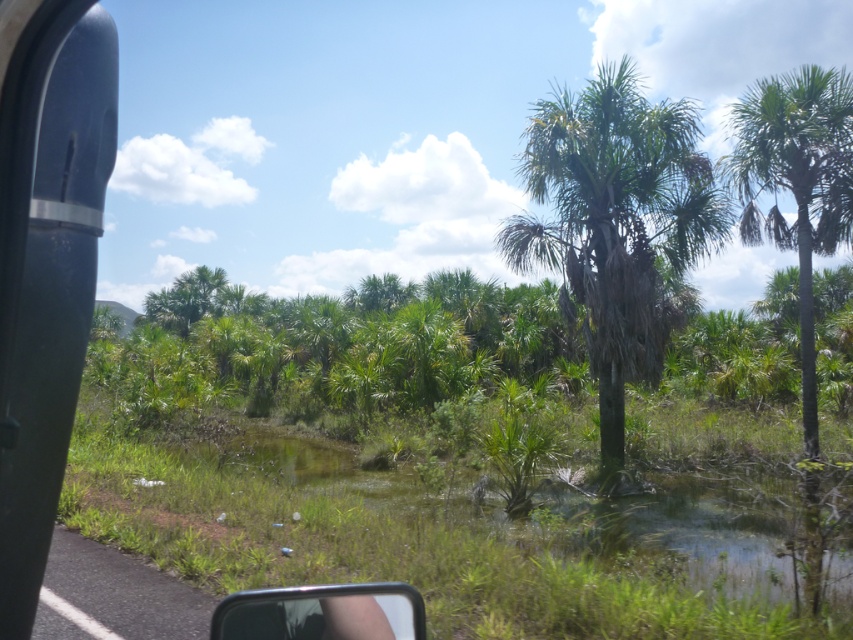
Question: Is green leafy palm tree at center bigger than clear plastic view mirror at lower center?

Choices:
 (A) yes
 (B) no

Answer: (A)

Question: Observing the image, what is the correct spatial positioning of green leafy palm tree at center in reference to green leafy palm tree at right?

Choices:
 (A) left
 (B) right

Answer: (A)

Question: Which of the following is the closest to the observer?

Choices:
 (A) (268, 598)
 (B) (817, 196)
 (C) (647, 198)

Answer: (A)

Question: Which object is closer to the camera taking this photo?

Choices:
 (A) green leafy palm tree at right
 (B) clear plastic view mirror at lower center
 (C) green leafy palm tree at center

Answer: (B)

Question: Can you confirm if green leafy palm tree at right is positioned to the right of clear plastic view mirror at lower center?

Choices:
 (A) no
 (B) yes

Answer: (B)

Question: Which point is closer to the camera?

Choices:
 (A) green leafy palm tree at right
 (B) green leafy palm tree at center

Answer: (B)